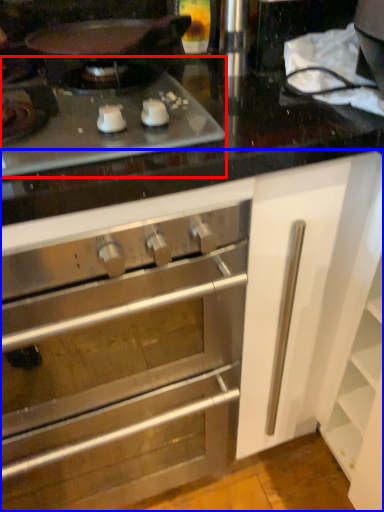
Question: Which point is closer to the camera, gas stove (highlighted by a red box) or cabinetry (highlighted by a blue box)?

Choices:
 (A) gas stove
 (B) cabinetry

Answer: (B)